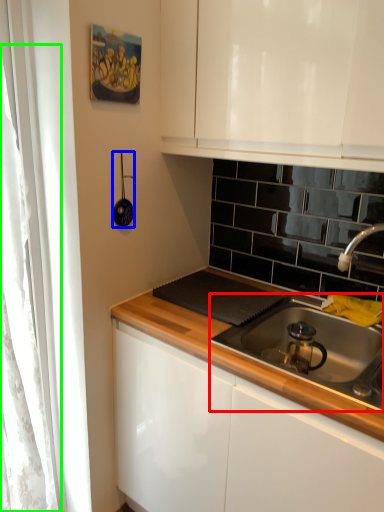
Question: Estimate the real-world distances between objects in this image. Which object is closer to gas stove (highlighted by a red box), appliance (highlighted by a blue box) or curtain (highlighted by a green box)?

Choices:
 (A) appliance
 (B) curtain

Answer: (A)